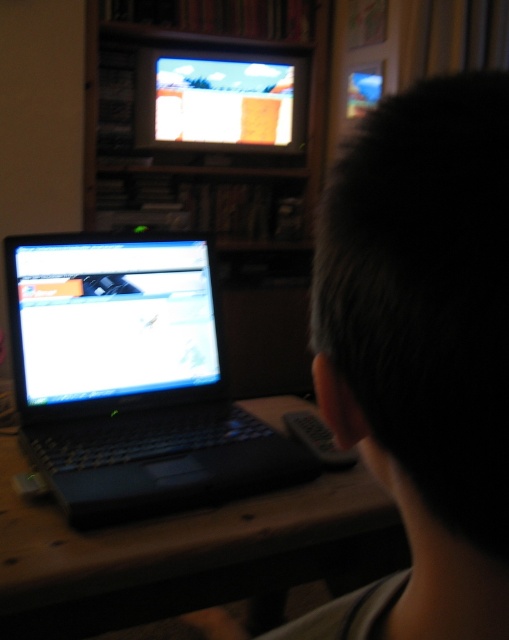
Which is above, wooden table at center or shiny black laptop at left?

shiny black laptop at left is above.

Identify the location of wooden table at center. The image size is (509, 640). (185, 554).

Locate an element on the screen. The height and width of the screenshot is (640, 509). wooden table at center is located at coordinates (185, 554).

Looking at this image, is dark hair at center positioned in front of black matte laptop at left?

Yes, dark hair at center is in front of black matte laptop at left.

Can you confirm if dark hair at center is positioned below black matte laptop at left?

Actually, dark hair at center is above black matte laptop at left.

Who is more forward, (385,486) or (94,509)?

Point (385,486)

Find the location of a particular element. This screenshot has width=509, height=640. dark hair at center is located at coordinates (421, 353).

Locate an element on the screen. The image size is (509, 640). black matte laptop at left is located at coordinates (131, 378).

The width and height of the screenshot is (509, 640). Describe the element at coordinates (131, 378) in the screenshot. I see `black matte laptop at left` at that location.

The height and width of the screenshot is (640, 509). In order to click on black matte laptop at left in this screenshot , I will do `click(131, 378)`.